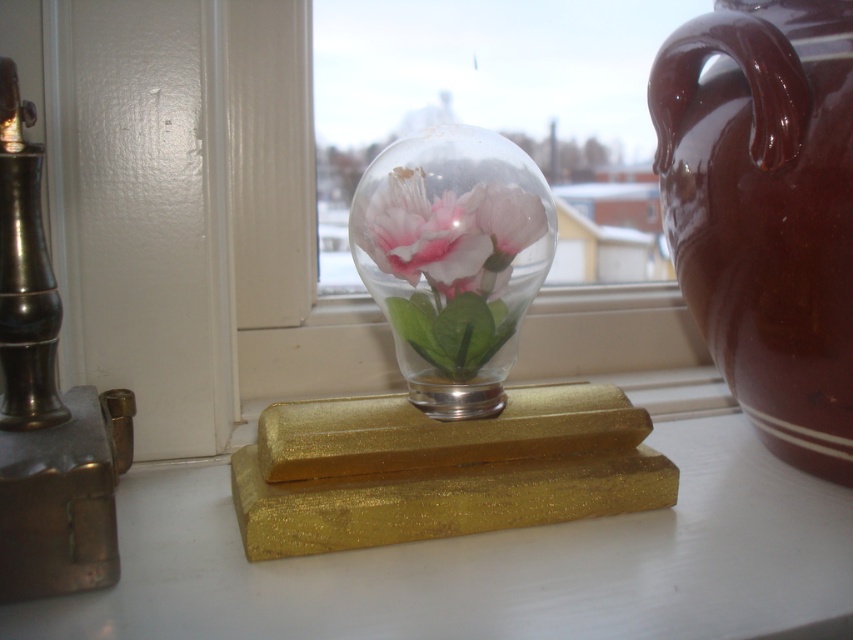
Which is behind, point (734, 272) or point (461, 192)?

Positioned behind is point (734, 272).

Is point (813, 104) closer to viewer compared to point (491, 232)?

No.

In order to click on burgundy ceramic vase at right in this screenshot , I will do [766, 211].

Is burgundy ceramic vase at right positioned behind pink matte flower at center?

Yes, burgundy ceramic vase at right is further from the viewer.

Does point (772, 316) lie behind point (401, 241)?

Yes, point (772, 316) is behind point (401, 241).

Does point (786, 204) come behind point (438, 225)?

Yes, point (786, 204) is behind point (438, 225).

Locate an element on the screen. The image size is (853, 640). burgundy ceramic vase at right is located at coordinates (766, 211).

Where is `gold glittery counter top at center`? gold glittery counter top at center is located at coordinates (490, 564).

This screenshot has height=640, width=853. What are the coordinates of `gold glittery counter top at center` in the screenshot? It's located at (490, 564).